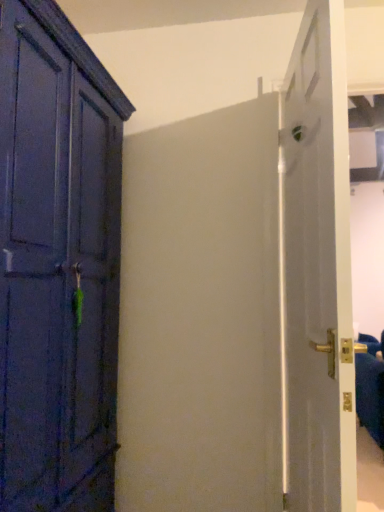
Question: Are gold metallic door handle at right and white glossy door at right beside each other?

Choices:
 (A) no
 (B) yes

Answer: (A)

Question: Is gold metallic door handle at right to the right of white glossy door at right from the viewer's perspective?

Choices:
 (A) yes
 (B) no

Answer: (A)

Question: Considering the relative sizes of gold metallic door handle at right and white glossy door at right in the image provided, is gold metallic door handle at right wider than white glossy door at right?

Choices:
 (A) yes
 (B) no

Answer: (A)

Question: From the image's perspective, is gold metallic door handle at right above white glossy door at right?

Choices:
 (A) yes
 (B) no

Answer: (B)

Question: Is gold metallic door handle at right turned away from white glossy door at right?

Choices:
 (A) no
 (B) yes

Answer: (A)

Question: Is gold metallic door handle at right shorter than white glossy door at right?

Choices:
 (A) yes
 (B) no

Answer: (A)

Question: Is white glossy door at right positioned before gold metallic door handle at right?

Choices:
 (A) no
 (B) yes

Answer: (B)

Question: Considering the relative positions of white glossy door at right and gold metallic door handle at right in the image provided, is white glossy door at right to the right of gold metallic door handle at right from the viewer's perspective?

Choices:
 (A) no
 (B) yes

Answer: (A)

Question: Is white glossy door at right smaller than gold metallic door handle at right?

Choices:
 (A) yes
 (B) no

Answer: (A)

Question: Does white glossy door at right have a larger size compared to gold metallic door handle at right?

Choices:
 (A) yes
 (B) no

Answer: (B)

Question: From a real-world perspective, is white glossy door at right positioned over gold metallic door handle at right based on gravity?

Choices:
 (A) yes
 (B) no

Answer: (A)

Question: From the image's perspective, is white glossy door at right on top of gold metallic door handle at right?

Choices:
 (A) yes
 (B) no

Answer: (A)

Question: From the image's perspective, is white glossy door at right positioned above or below gold metallic door handle at right?

Choices:
 (A) above
 (B) below

Answer: (A)